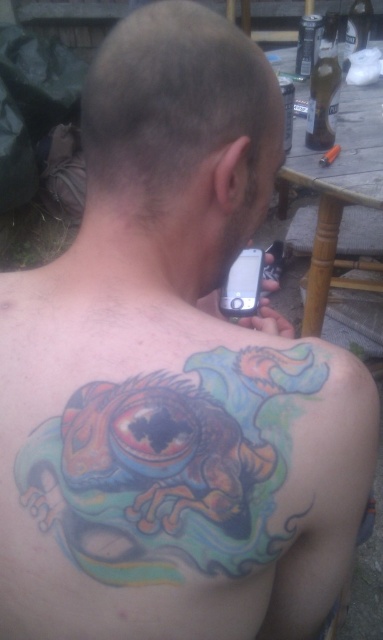
Question: Which object is farther from the camera taking this photo?

Choices:
 (A) colorful tattoo at upper back
 (B) shiny hair at upper center

Answer: (B)

Question: From the image, what is the correct spatial relationship of colorful tattoo at upper back in relation to shiny hair at upper center?

Choices:
 (A) right
 (B) left

Answer: (A)

Question: From the image, what is the correct spatial relationship of colorful tattoo at upper back in relation to shiny hair at upper center?

Choices:
 (A) above
 (B) below

Answer: (B)

Question: Which of the following is the farthest from the observer?

Choices:
 (A) (206, 477)
 (B) (222, 36)

Answer: (B)

Question: Can you confirm if colorful tattoo at upper back is positioned above shiny hair at upper center?

Choices:
 (A) yes
 (B) no

Answer: (B)